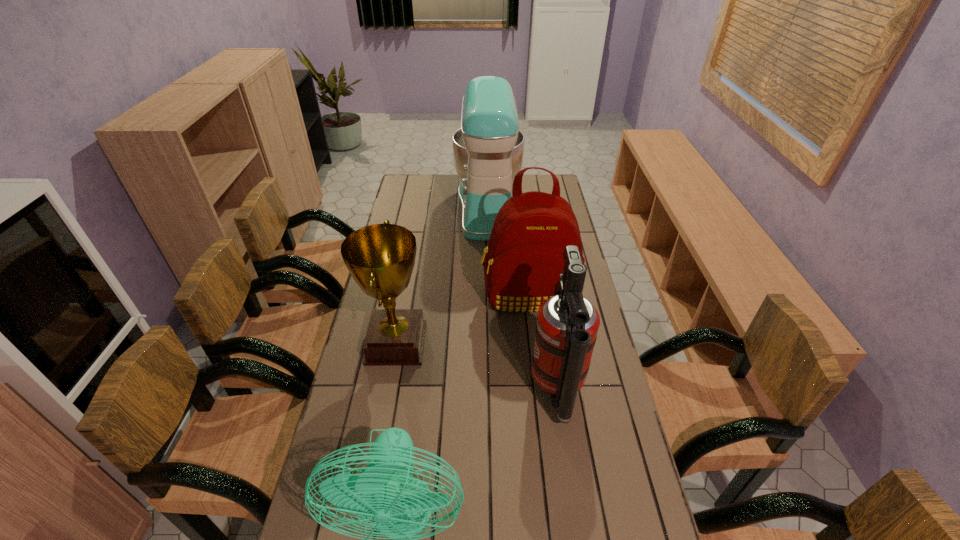
In order to click on mixer in this screenshot , I will do `click(488, 149)`.

Where is `backpack`? This screenshot has width=960, height=540. backpack is located at coordinates (524, 258).

This screenshot has height=540, width=960. I want to click on fire extinguisher, so click(567, 325).

Locate an element on the screen. Image resolution: width=960 pixels, height=540 pixels. award is located at coordinates (380, 257).

The width and height of the screenshot is (960, 540). I want to click on free spot located 0.190m at the base of the farthest object, so click(413, 207).

Where is `blank area located at the base of the farthest object`? blank area located at the base of the farthest object is located at coordinates (399, 207).

The height and width of the screenshot is (540, 960). I want to click on vacant space located at the base of the farthest object, so (406, 207).

In order to click on free point located 0.110m on the front-facing side of the backpack in this screenshot , I will do `click(535, 343)`.

Find the location of a particular element. This screenshot has height=540, width=960. blank space located on the front label side of the fire extinguisher is located at coordinates (434, 391).

The height and width of the screenshot is (540, 960). Find the location of `free region located on the front label side of the fire extinguisher`. free region located on the front label side of the fire extinguisher is located at coordinates (458, 391).